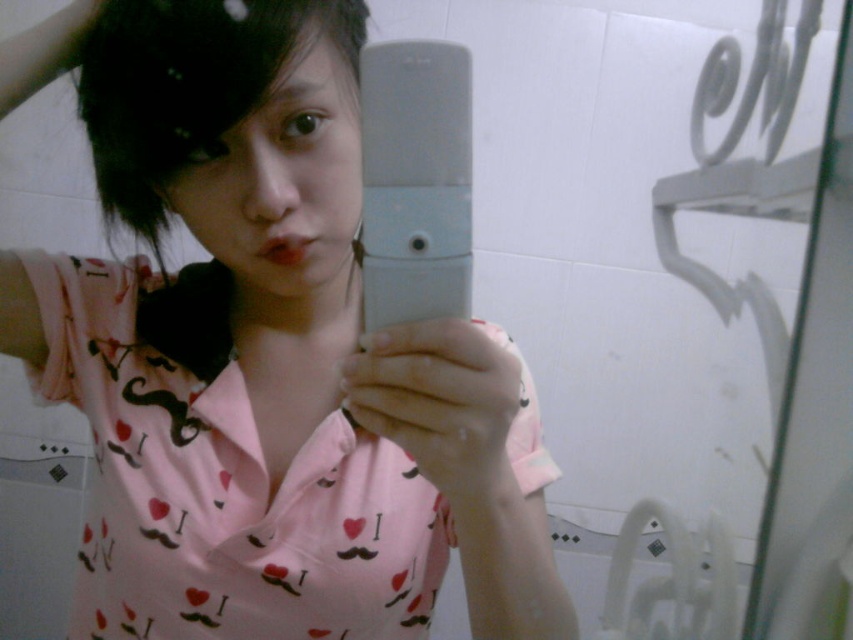
Question: Can you confirm if pink fabric shirt at center is positioned below black matte hair at upper left?

Choices:
 (A) no
 (B) yes

Answer: (B)

Question: Which point is farther to the camera?

Choices:
 (A) gray matte smartphone at center
 (B) pink fabric shirt at center
 (C) black matte hair at upper left

Answer: (C)

Question: Is the position of pink fabric shirt at center less distant than that of black matte hair at upper left?

Choices:
 (A) no
 (B) yes

Answer: (B)

Question: Is black matte hair at upper left to the left of gray matte smartphone at center from the viewer's perspective?

Choices:
 (A) yes
 (B) no

Answer: (A)

Question: Which of the following is the farthest from the observer?

Choices:
 (A) black matte hair at upper left
 (B) gray matte smartphone at center

Answer: (A)

Question: Among these objects, which one is farthest from the camera?

Choices:
 (A) pink fabric shirt at center
 (B) gray matte smartphone at center

Answer: (A)